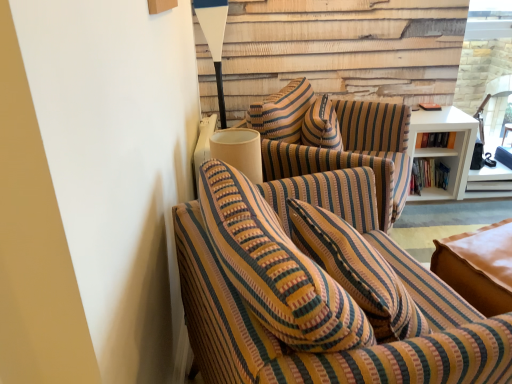
Question: Considering their positions, is white matte shelf at right located in front of or behind hardcover books at upper right, which is counted as the first book, starting from the top?

Choices:
 (A) front
 (B) behind

Answer: (A)

Question: Which is correct: white matte shelf at right is inside hardcover books at upper right, which is the second book in bottom-to-top order, or outside of it?

Choices:
 (A) inside
 (B) outside

Answer: (B)

Question: Estimate the real-world distances between objects in this image. Which object is closer to the hardcover books at right, the 1th book in the bottom-to-top sequence?

Choices:
 (A) hardcover books at upper right, which is counted as the first book, starting from the top
 (B) clear glass door at upper right
 (C) white glossy table lamp at upper center
 (D) white matte shelf at right
 (E) striped fabric couch at center, the 2th studio couch positioned from the back

Answer: (D)

Question: Considering the real-world distances, which object is closest to the white glossy table lamp at upper center?

Choices:
 (A) striped fabric couch at center, positioned as the second studio couch in front-to-back order
 (B) striped fabric couch at center, which ranks as the first studio couch in front-to-back order
 (C) hardcover books at right, the 1th book in the bottom-to-top sequence
 (D) white matte shelf at right
 (E) clear glass door at upper right

Answer: (A)